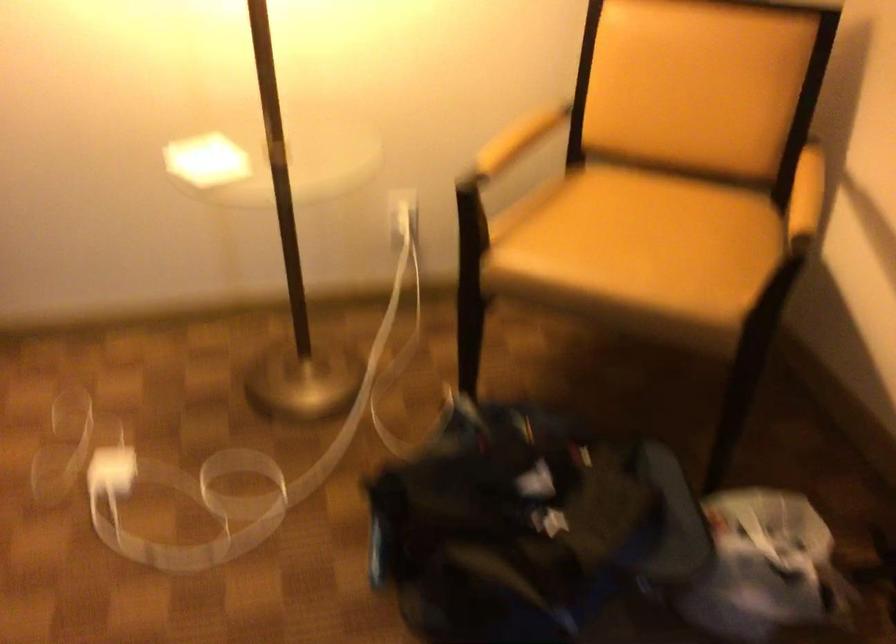
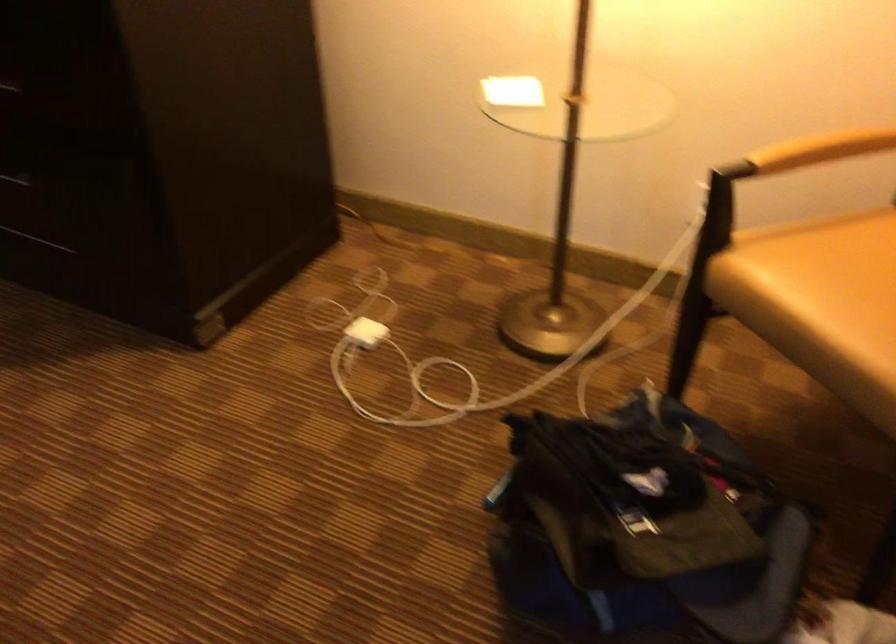
Locate, in the second image, the point that corresponds to (x=606, y=270) in the first image.

(821, 303)